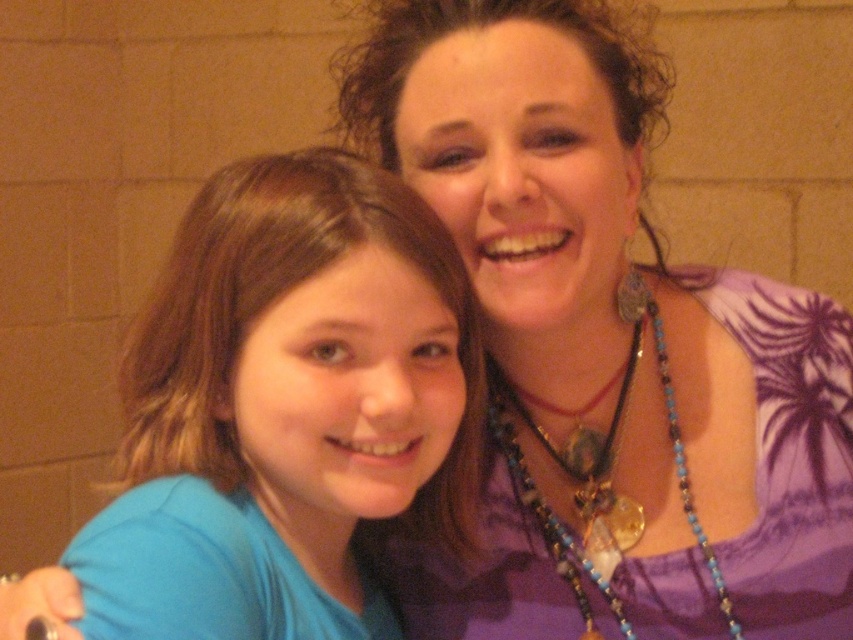
Between purple fabric at center and blue fabric shirt at center, which one has less height?

blue fabric shirt at center is shorter.

Which is in front, point (613, 552) or point (270, 275)?

Point (270, 275) is in front.

The image size is (853, 640). Identify the location of purple fabric at center. (619, 317).

Does point (791, 348) come in front of point (618, 529)?

Yes, point (791, 348) is closer to viewer.

Between point (737, 616) and point (654, 346), which one is positioned in front?

Point (737, 616) is in front.

Between point (579, 328) and point (577, 595), which one is positioned in front?

Point (577, 595) is more forward.

Where is `purple fabric at center`? This screenshot has height=640, width=853. purple fabric at center is located at coordinates (619, 317).

Does point (367, 516) come in front of point (556, 552)?

Yes, point (367, 516) is closer to viewer.

Which is behind, point (405, 484) or point (618, 397)?

Positioned behind is point (618, 397).

The image size is (853, 640). In order to click on blue fabric shirt at center in this screenshot , I will do `click(310, 356)`.